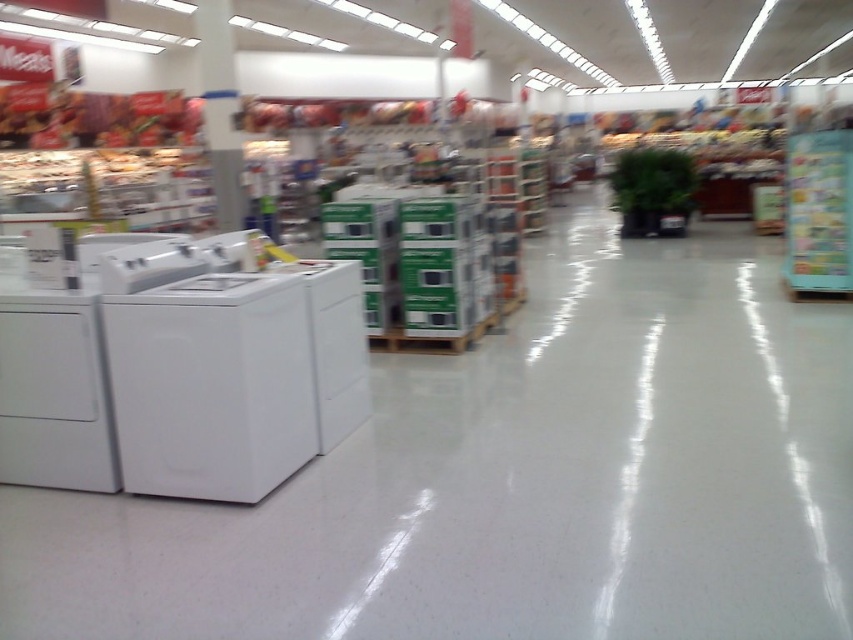
Question: Which of the following is the farthest from the observer?

Choices:
 (A) (343, 365)
 (B) (210, 454)

Answer: (A)

Question: Is white glossy washer at left to the left of white glossy washer at center from the viewer's perspective?

Choices:
 (A) no
 (B) yes

Answer: (B)

Question: Does white glossy washer at left appear on the right side of white glossy washer at center?

Choices:
 (A) no
 (B) yes

Answer: (A)

Question: Is white glossy washer at left to the right of white glossy washer at center from the viewer's perspective?

Choices:
 (A) no
 (B) yes

Answer: (A)

Question: Which object appears farthest from the camera in this image?

Choices:
 (A) white glossy washer at left
 (B) white glossy washer at center

Answer: (B)